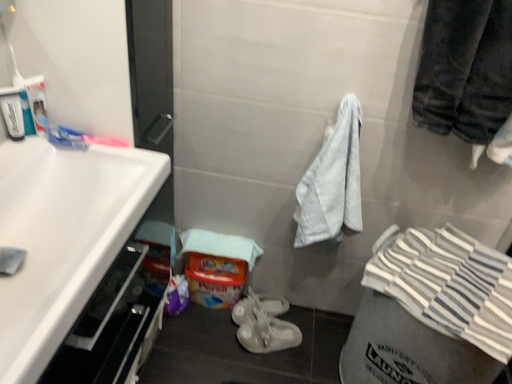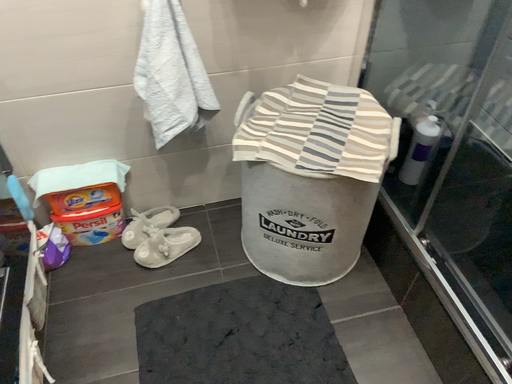
Question: How did the camera likely rotate when shooting the video?

Choices:
 (A) rotated downward
 (B) rotated upward

Answer: (A)